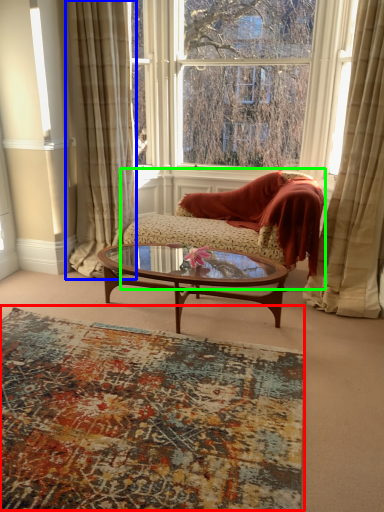
Question: Which object is positioned farthest from plain (highlighted by a red box)? Select from curtain (highlighted by a blue box) and studio couch (highlighted by a green box).

Choices:
 (A) curtain
 (B) studio couch

Answer: (A)